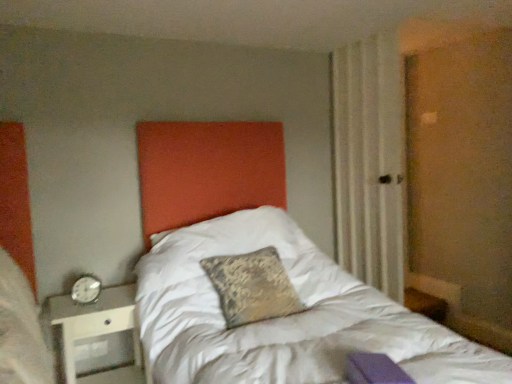
Question: Considering the positions of metallic silver nightstand at lower left and silver metallic alarm clock at left in the image, is metallic silver nightstand at lower left wider or thinner than silver metallic alarm clock at left?

Choices:
 (A) wide
 (B) thin

Answer: (A)

Question: Is metallic silver nightstand at lower left situated inside silver metallic alarm clock at left or outside?

Choices:
 (A) outside
 (B) inside

Answer: (A)

Question: Considering the real-world distances, which object is closest to the beige textured curtain at right?

Choices:
 (A) metallic silver nightstand at lower left
 (B) silver metallic alarm clock at left

Answer: (A)

Question: Based on their relative distances, which object is nearer to the beige textured curtain at right?

Choices:
 (A) metallic silver nightstand at lower left
 (B) silver metallic alarm clock at left

Answer: (A)